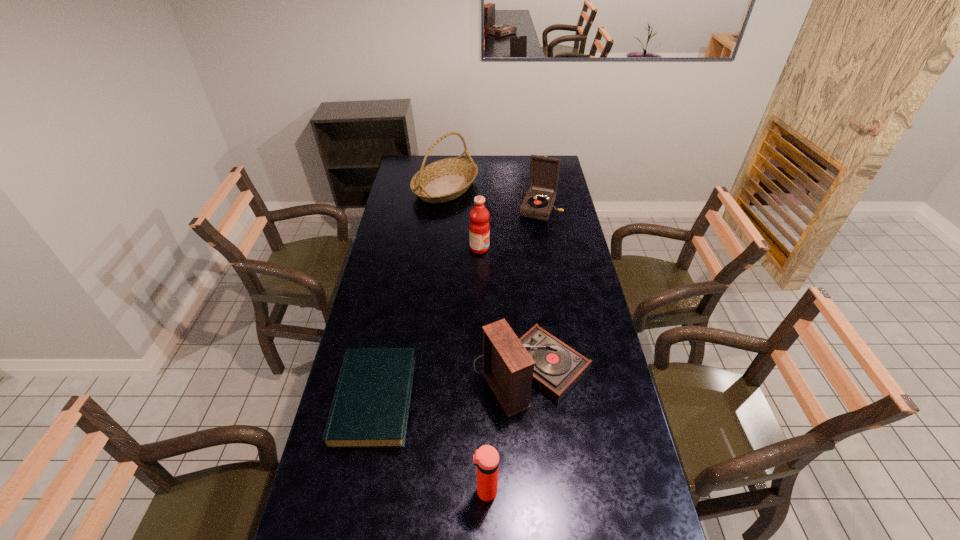
The image size is (960, 540). In order to click on basket in this screenshot , I will do `click(444, 180)`.

Where is `the third farthest object`? The image size is (960, 540). the third farthest object is located at coordinates (479, 228).

Locate an element on the screen. the farther phonograph record is located at coordinates (544, 171).

This screenshot has height=540, width=960. Find the location of `the nearer phonograph record`. the nearer phonograph record is located at coordinates (511, 365).

The width and height of the screenshot is (960, 540). Identify the location of thermos bottle. (486, 458).

Where is `the shortest object`? This screenshot has width=960, height=540. the shortest object is located at coordinates (370, 408).

Where is `vacant space situated 0.390m on the front of the basket`? The image size is (960, 540). vacant space situated 0.390m on the front of the basket is located at coordinates (438, 261).

At what (x,y) coordinates should I click in order to perform the action: click on vacant space located on the front label of the fourth nearest object. Please return your answer as a coordinate pair (x, y). Looking at the image, I should click on (559, 248).

This screenshot has height=540, width=960. What are the coordinates of `free region located 0.290m on the front of the farther phonograph record` in the screenshot? It's located at (549, 261).

The image size is (960, 540). I want to click on vacant area located on the back of the nearer phonograph record, so click(527, 322).